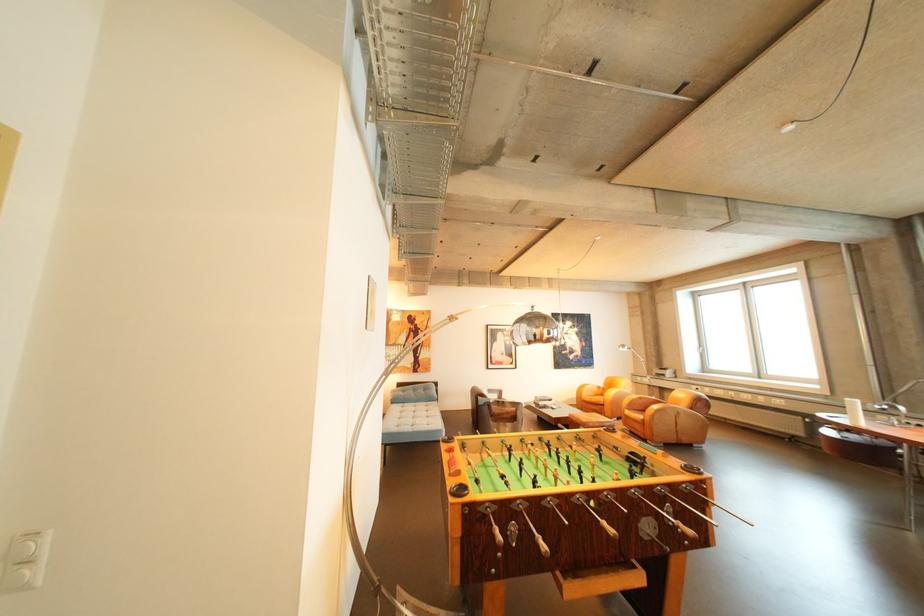
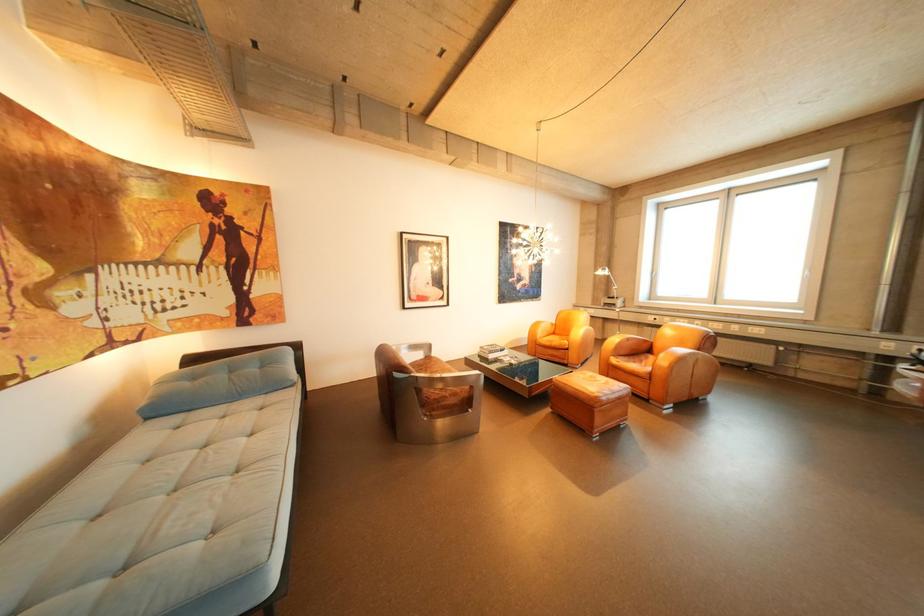
Question: The images are taken continuously from a first-person perspective. In which direction are you moving?

Choices:
 (A) Left
 (B) Right
 (C) Forward
 (D) Backward

Answer: (C)